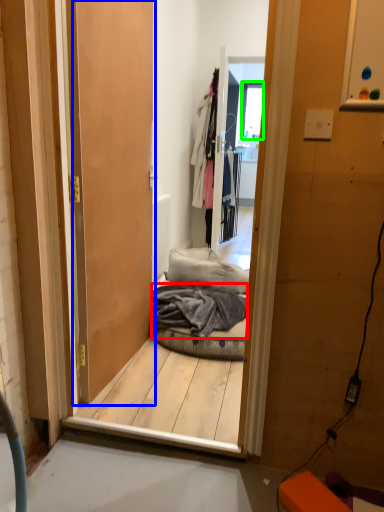
Question: Which is farther away from material (highlighted by a red box)? door (highlighted by a blue box) or window (highlighted by a green box)?

Choices:
 (A) door
 (B) window

Answer: (B)